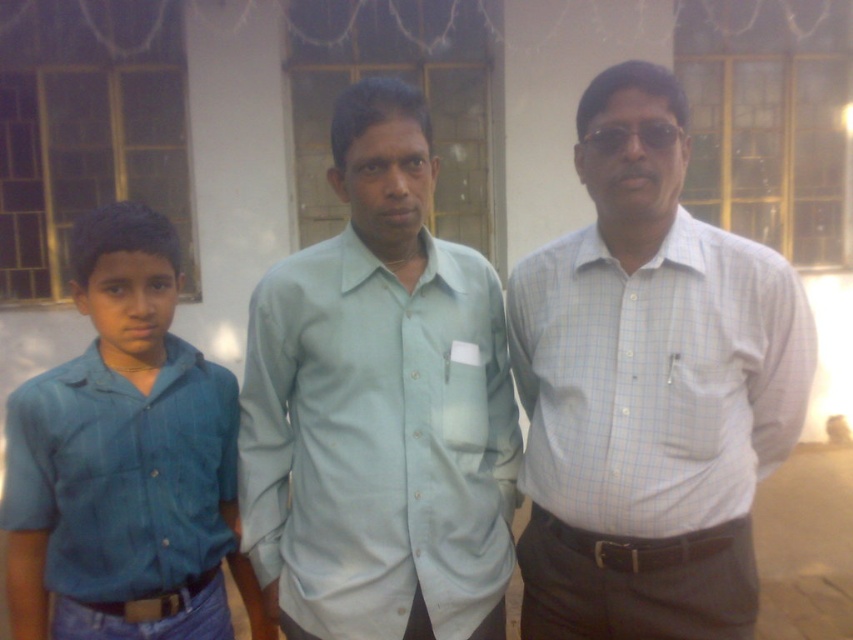
Question: Can you confirm if white checkered shirt at center is positioned to the left of blue denim shirt at left?

Choices:
 (A) yes
 (B) no

Answer: (B)

Question: Considering the real-world distances, which object is closest to the light blue cotton shirt at center?

Choices:
 (A) blue denim shirt at left
 (B) white checkered shirt at center

Answer: (B)

Question: In this image, where is white checkered shirt at center located relative to blue denim shirt at left?

Choices:
 (A) below
 (B) above

Answer: (B)

Question: Which point is farther from the camera taking this photo?

Choices:
 (A) (581, 106)
 (B) (126, 509)

Answer: (B)

Question: Does light blue cotton shirt at center appear under blue denim shirt at left?

Choices:
 (A) yes
 (B) no

Answer: (B)

Question: Which of these objects is positioned farthest from the light blue cotton shirt at center?

Choices:
 (A) white checkered shirt at center
 (B) blue denim shirt at left

Answer: (B)